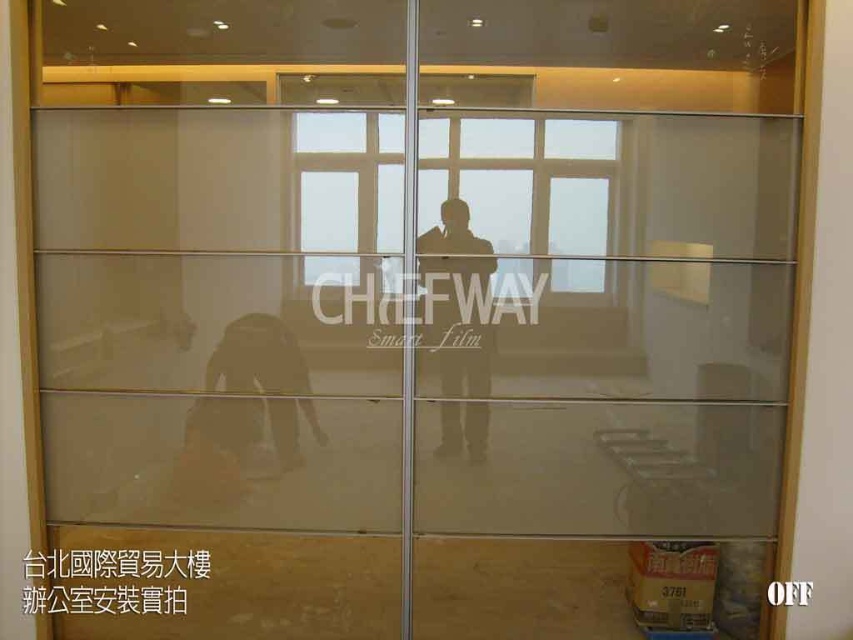
Can you confirm if transparent glass window at center is bigger than translucent glass person at center?

Yes.

Between transparent glass window at center and translucent glass person at center, which one is positioned lower?

Positioned lower is translucent glass person at center.

Locate an element on the screen. The height and width of the screenshot is (640, 853). transparent glass window at center is located at coordinates (521, 180).